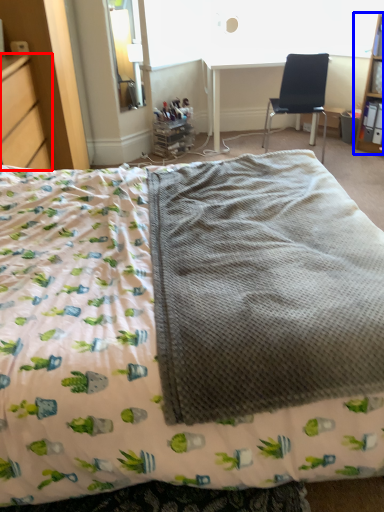
Question: Which of the following is the farthest to the observer, file cabinet (highlighted by a red box) or shelf (highlighted by a blue box)?

Choices:
 (A) file cabinet
 (B) shelf

Answer: (B)